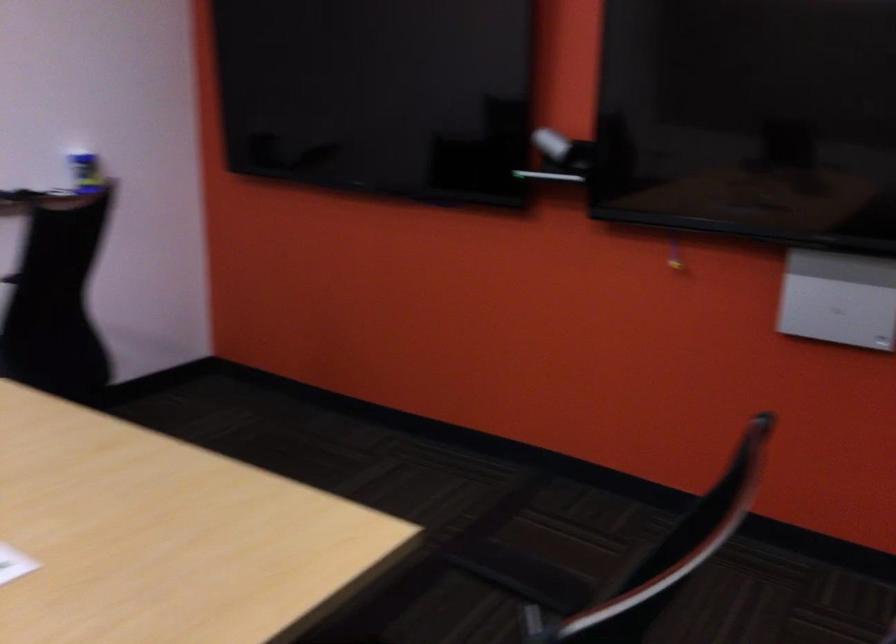
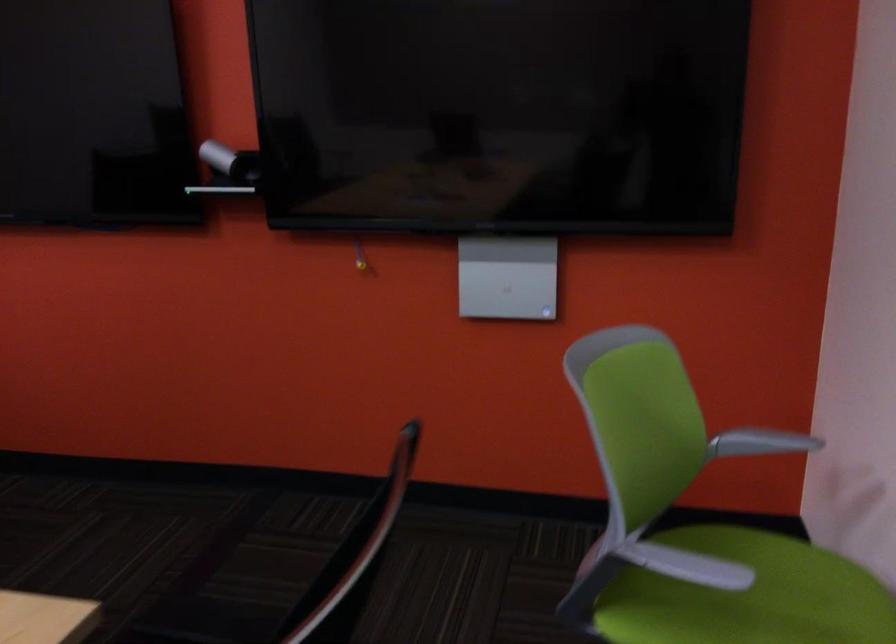
The point at (x=565, y=147) is marked in the first image. Where is the corresponding point in the second image?

(230, 162)